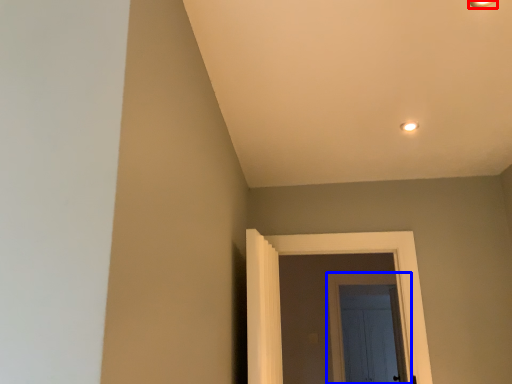
Question: Among these objects, which one is nearest to the camera, light fixture (highlighted by a red box) or door (highlighted by a blue box)?

Choices:
 (A) light fixture
 (B) door

Answer: (A)